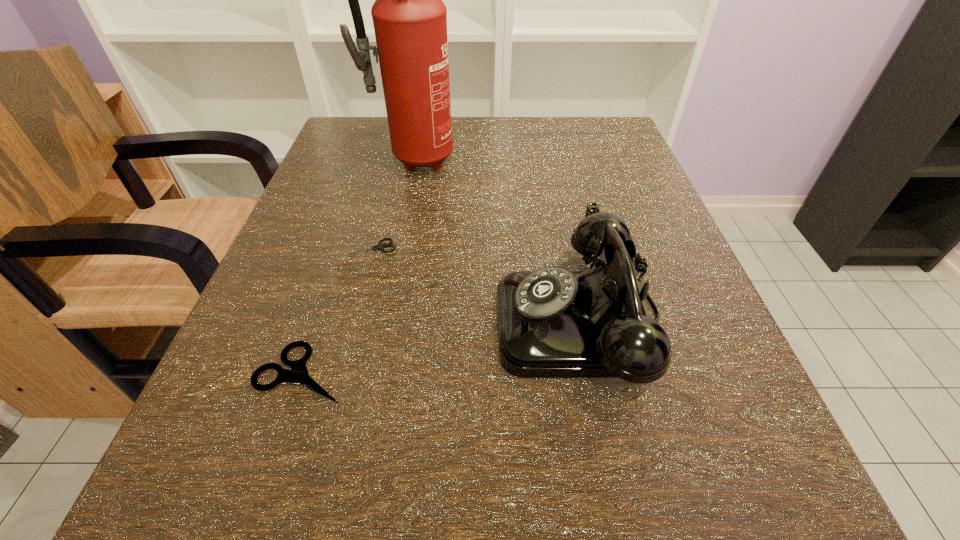
At what (x,y) coordinates should I click in order to perform the action: click on empty space between the tallest object and the farther shears. Please return your answer as a coordinate pair (x, y). The width and height of the screenshot is (960, 540). Looking at the image, I should click on (389, 204).

Identify the location of blank region between the fire extinguisher and the farther shears. The width and height of the screenshot is (960, 540). (389, 204).

Locate an element on the screen. The image size is (960, 540). free spot between the farthest object and the taller shears is located at coordinates (356, 266).

Choose which object is the second nearest neighbor to the third tallest object. Please provide its 2D coordinates. Your answer should be formatted as a tuple, i.e. [(x, y)], where the tuple contains the x and y coordinates of a point satisfying the conditions above.

[(552, 323)]

Identify which object is the third nearest to the rightmost object. Please provide its 2D coordinates. Your answer should be formatted as a tuple, i.e. [(x, y)], where the tuple contains the x and y coordinates of a point satisfying the conditions above.

[(410, 19)]